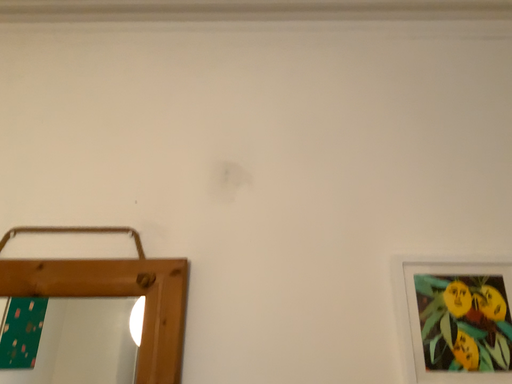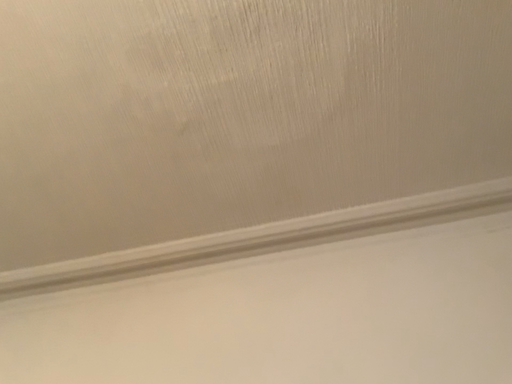
Question: How did the camera likely rotate when shooting the video?

Choices:
 (A) rotated upward
 (B) rotated downward

Answer: (A)